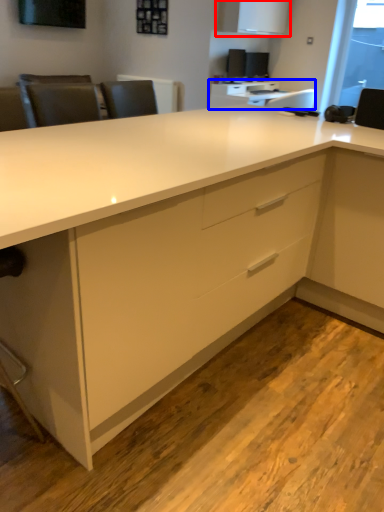
Question: Which point is closer to the camera, cabinetry (highlighted by a red box) or table (highlighted by a blue box)?

Choices:
 (A) cabinetry
 (B) table

Answer: (A)